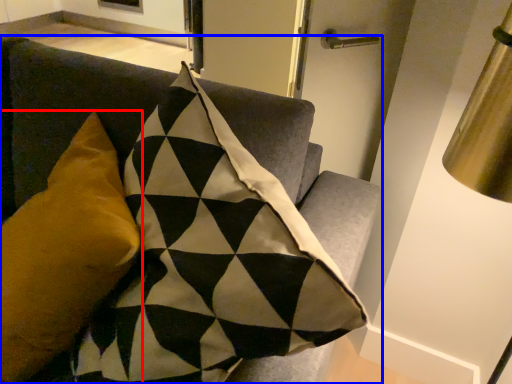
Question: Which point is closer to the camera, pillow (highlighted by a red box) or furniture (highlighted by a blue box)?

Choices:
 (A) pillow
 (B) furniture

Answer: (B)